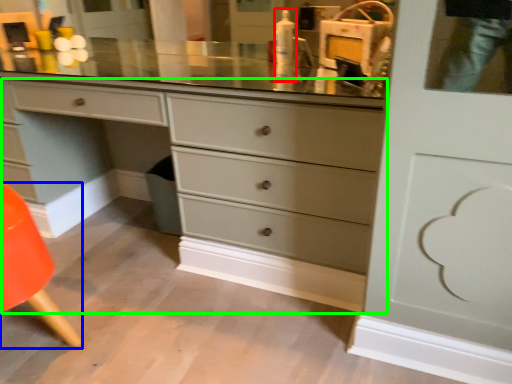
Question: Which is farther away from toiletry (highlighted by a red box)? armchair (highlighted by a blue box) or chest of drawers (highlighted by a green box)?

Choices:
 (A) armchair
 (B) chest of drawers

Answer: (A)